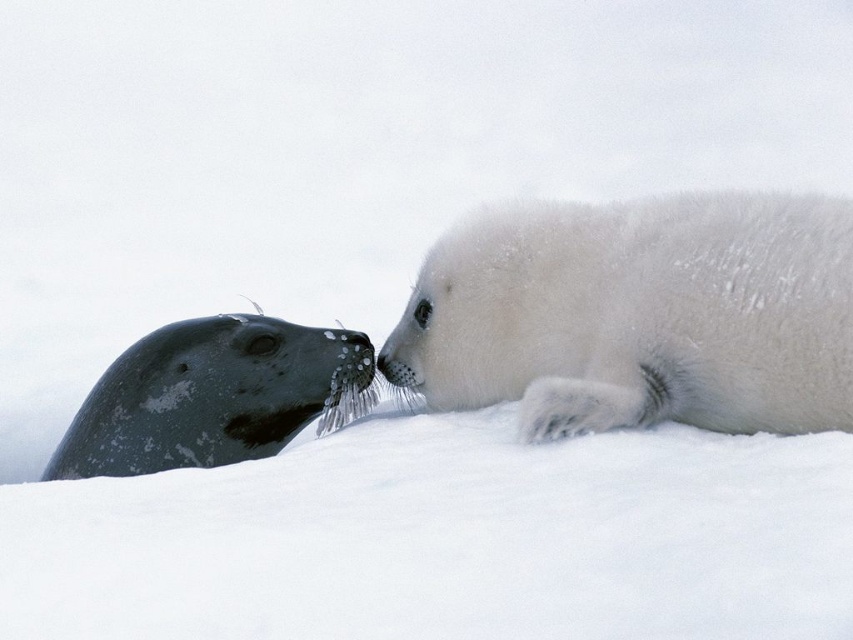
Does white fluffy seal at right appear over gray textured seal at left?

Correct, white fluffy seal at right is located above gray textured seal at left.

Which is more to the right, white fluffy seal at right or gray textured seal at left?

Positioned to the right is white fluffy seal at right.

Which is in front, point (425, 268) or point (308, 400)?

Point (425, 268) is in front.

At what (x,y) coordinates should I click in order to perform the action: click on white fluffy seal at right. Please return your answer as a coordinate pair (x, y). Looking at the image, I should click on (637, 316).